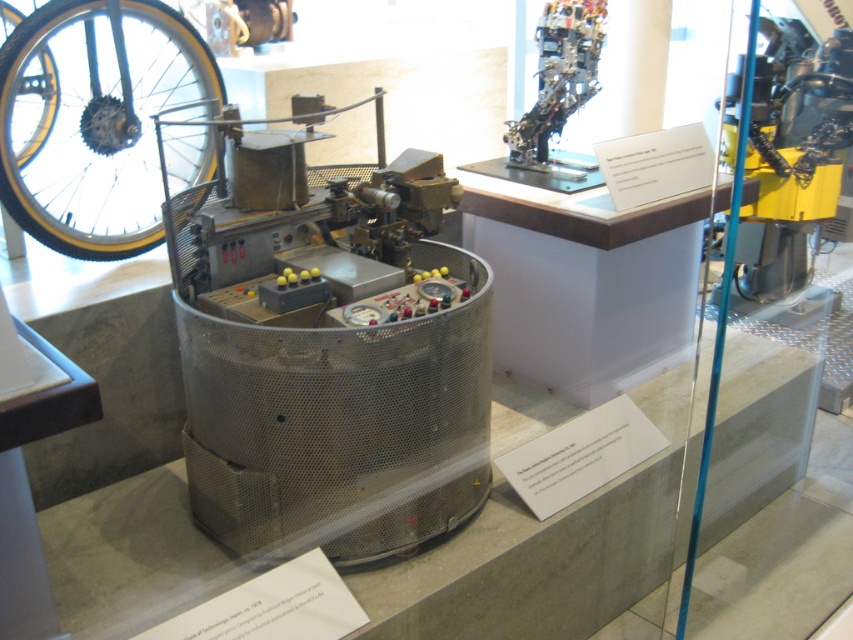
You are a security guard in the museum and need to check both the metallic mesh machine at center and the yellow rubber bicycle wheel at left. Starting from the entrance, which object should you check first based on their positions?

The yellow rubber bicycle wheel at left is located to the left of the metallic mesh machine at center, so you should check the yellow rubber bicycle wheel at left first as it is closer to the entrance.

You are a museum visitor standing in front of the vintage industrial machine. You notice a point labeled as point (x=328, y=349). What does this point correspond to?

The point (x=328, y=349) corresponds to the metallic mesh machine at center.

You are a visitor at the museum and see the metallic mesh machine at center and the yellow rubber bicycle wheel at left. Which object is positioned lower in the image?

The metallic mesh machine at center is positioned lower than the yellow rubber bicycle wheel at left.